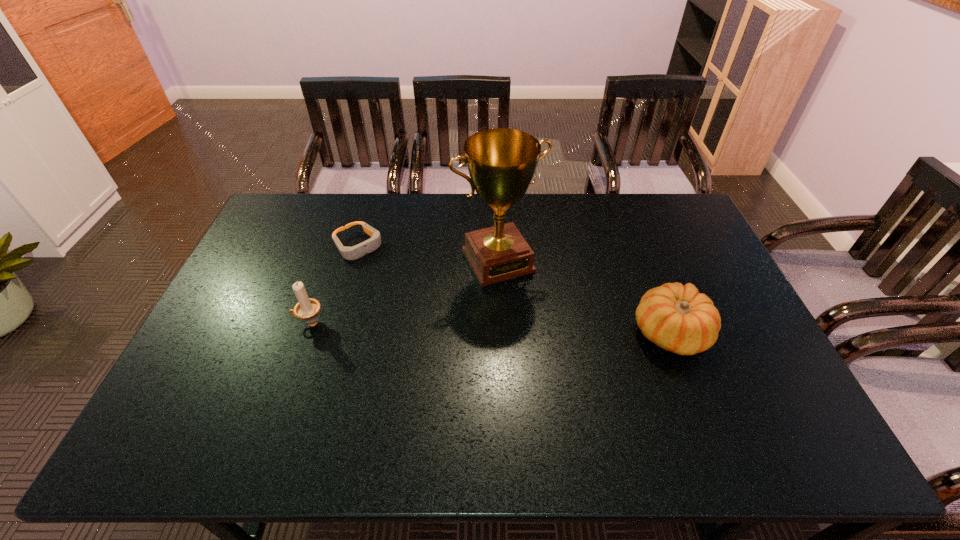
Find the location of `vacant spot on the desktop that is between the candle_holder and the rightmost object and is positioned on the front and back of the shortest object`. vacant spot on the desktop that is between the candle_holder and the rightmost object and is positioned on the front and back of the shortest object is located at coordinates (439, 327).

Locate an element on the screen. The image size is (960, 540). free space on the desktop that is between the candle_holder and the gourd and is positioned on the plaque of the award is located at coordinates (538, 329).